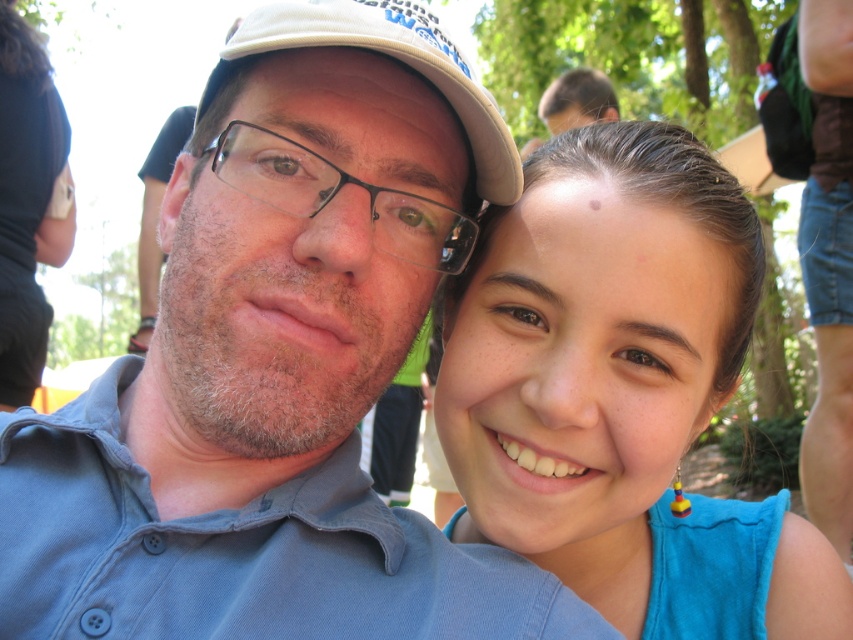
From the picture: Who is more forward, (233, 474) or (845, 612)?

Point (233, 474)

The width and height of the screenshot is (853, 640). In order to click on blue denim shirt at center in this screenshot , I will do `click(279, 364)`.

Which is more to the left, blue fabric at upper right or white fabric cap at upper center?

From the viewer's perspective, white fabric cap at upper center appears more on the left side.

Is blue fabric at upper right smaller than white fabric cap at upper center?

Actually, blue fabric at upper right might be larger than white fabric cap at upper center.

The width and height of the screenshot is (853, 640). Identify the location of blue fabric at upper right. (619, 388).

Is point (74, 573) farther from viewer compared to point (403, 42)?

Yes, point (74, 573) is farther from viewer.

Does blue denim shirt at center appear under white fabric cap at upper center?

Yes.

What are the coordinates of `blue denim shirt at center` in the screenshot? It's located at (279, 364).